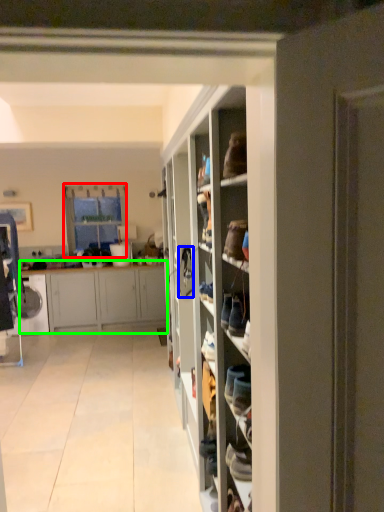
Question: Which object is positioned closest to window (highlighted by a red box)? Select from shoe (highlighted by a blue box) and cabinetry (highlighted by a green box).

Choices:
 (A) shoe
 (B) cabinetry

Answer: (B)